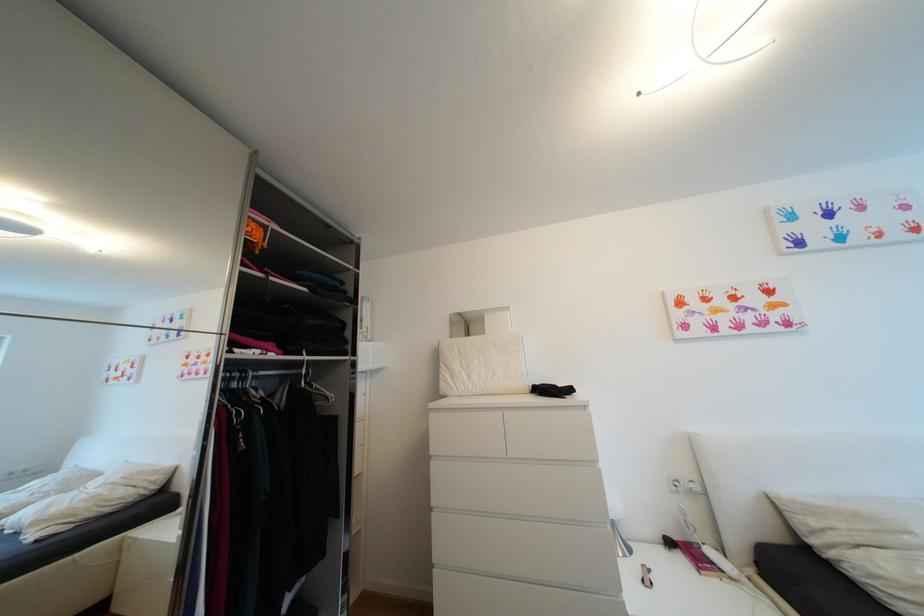
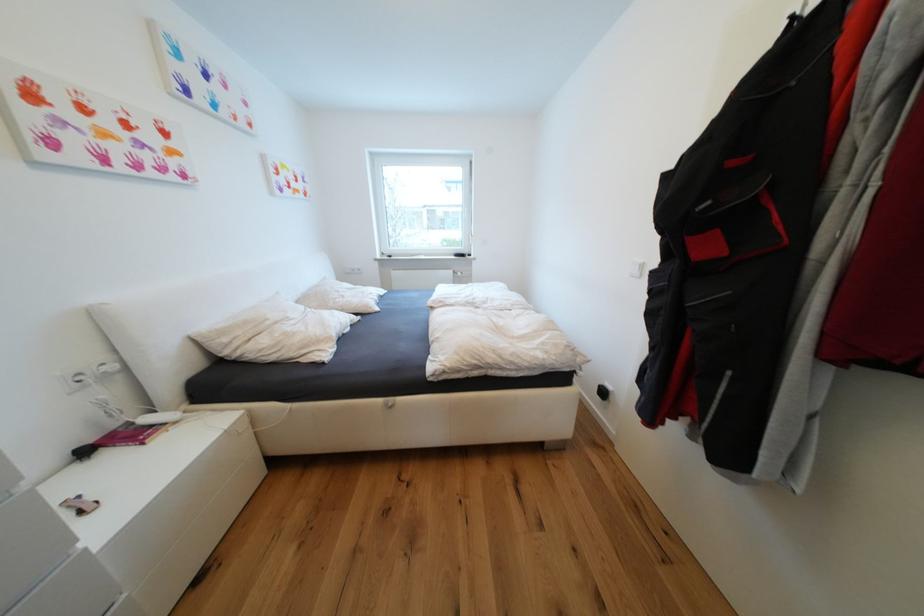
Locate, in the second image, the point that corresponds to pixel 719 564 in the first image.

(159, 428)